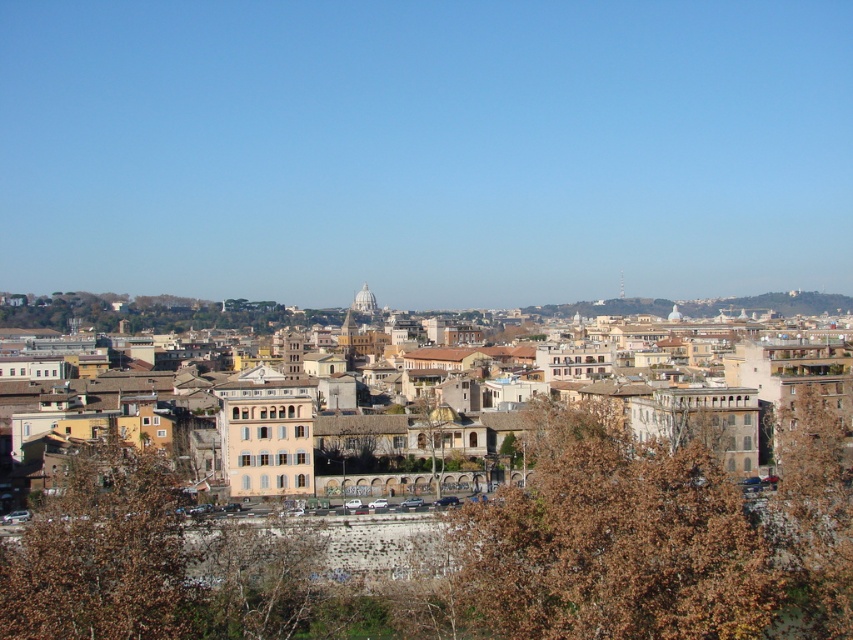
Question: Which point is farther to the camera?

Choices:
 (A) brown leafy tree at lower center
 (B) brown leafy tree at lower left

Answer: (A)

Question: Can you confirm if brown leafy tree at right is positioned above brown textured tree at center?

Choices:
 (A) yes
 (B) no

Answer: (B)

Question: Is brown leafy tree at lower center smaller than brown textured tree at center?

Choices:
 (A) no
 (B) yes

Answer: (A)

Question: Does brown leafy tree at lower left have a greater width compared to brown textured tree at center?

Choices:
 (A) yes
 (B) no

Answer: (A)

Question: Which point is closer to the camera?

Choices:
 (A) (837, 604)
 (B) (83, 605)
 (C) (440, 432)
 (D) (828, 518)

Answer: (B)

Question: Which of the following is the farthest from the observer?

Choices:
 (A) (547, 556)
 (B) (436, 490)
 (C) (792, 413)

Answer: (C)